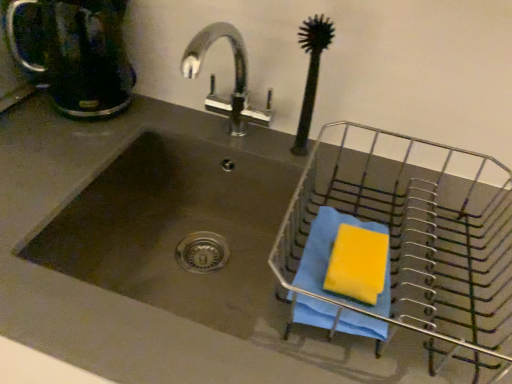
This screenshot has height=384, width=512. I want to click on free spot behind yellow sponge at right, so click(372, 203).